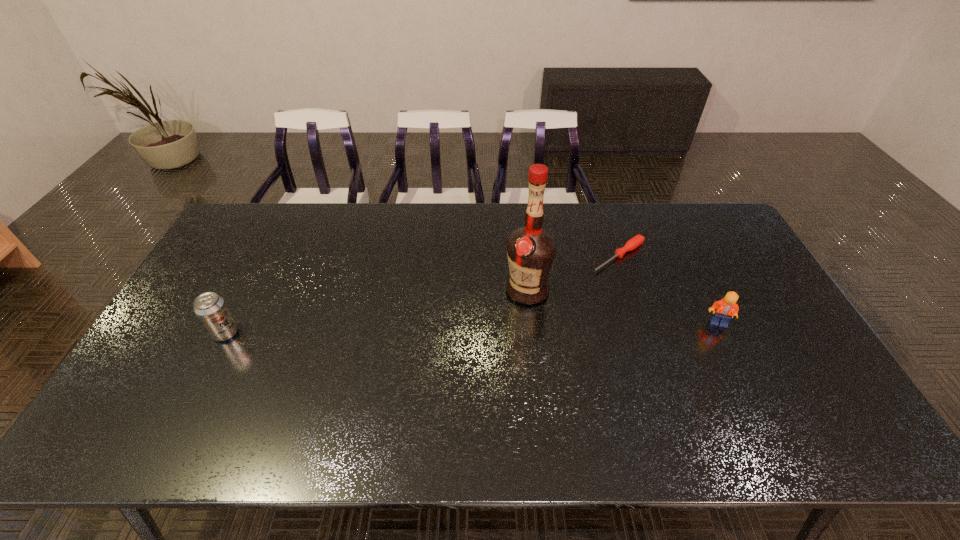
Where is `blank space at the far left corner of the desktop`? The height and width of the screenshot is (540, 960). blank space at the far left corner of the desktop is located at coordinates (284, 208).

The width and height of the screenshot is (960, 540). Identify the location of free space at the near left corner of the desktop. (191, 381).

I want to click on blank space at the far right corner of the desktop, so click(x=712, y=210).

At what (x,y) coordinates should I click in order to perform the action: click on vacant area at the near right corner of the desktop. Please return your answer as a coordinate pair (x, y). Looking at the image, I should click on (822, 381).

Identify the location of vacant area between the third object from left to right and the rightmost object. This screenshot has height=540, width=960. (668, 289).

The width and height of the screenshot is (960, 540). Identify the location of vacant space in between the beer can and the rightmost object. (472, 328).

Locate an element on the screen. The width and height of the screenshot is (960, 540). unoccupied area between the rightmost object and the leftmost object is located at coordinates [472, 328].

You are a GUI agent. You are given a task and a screenshot of the screen. Output one action in this format:
    pyautogui.click(x=<x>, y=<y>)
    Task: Click on the vacant area between the tallest object and the Lego
    The width and height of the screenshot is (960, 540).
    Given the screenshot: What is the action you would take?
    pyautogui.click(x=622, y=306)

Find the location of a particular element. This screenshot has height=540, width=960. blank region between the second object from left to right and the screwdriver is located at coordinates (573, 273).

The height and width of the screenshot is (540, 960). I want to click on vacant area that lies between the beer can and the farthest object, so click(x=422, y=294).